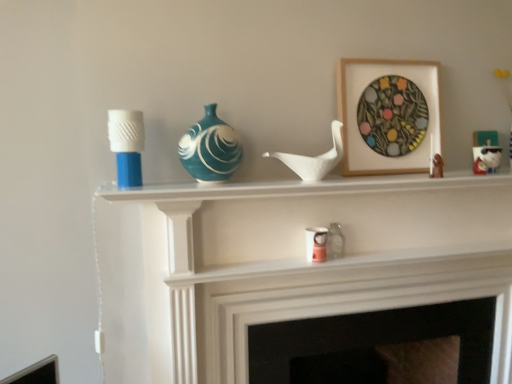
What do you see at coordinates (312, 263) in the screenshot? I see `white glossy fireplace at center` at bounding box center [312, 263].

Describe the element at coordinates (314, 158) in the screenshot. I see `white matte bird at center, the 3th toy when ordered from back to front` at that location.

The width and height of the screenshot is (512, 384). Identify the location of pink paper cup at center, placed as the 2th candle holder when sorted from top to bottom. (316, 244).

What do you see at coordinates (486, 152) in the screenshot? The image size is (512, 384). I see `white glossy figurine at upper right, which ranks as the first toy in right-to-left order` at bounding box center [486, 152].

The height and width of the screenshot is (384, 512). Identify the location of wooden picture frame at upper center. (356, 106).

Identify the location of white glossy fireplace at center. The image size is (512, 384). (312, 263).

Does teal glossy vase at center have a greater width compared to matte brown figurine at upper right, arranged as the second toy when viewed from the front?

Correct, the width of teal glossy vase at center exceeds that of matte brown figurine at upper right, arranged as the second toy when viewed from the front.

What's the angular difference between teal glossy vase at center and matte brown figurine at upper right, which is the 2th toy in left-to-right order,'s facing directions?

The angular difference between teal glossy vase at center and matte brown figurine at upper right, which is the 2th toy in left-to-right order, is 19 degrees.

Does teal glossy vase at center come behind matte brown figurine at upper right, placed as the second toy when sorted from right to left?

No, teal glossy vase at center is closer to the camera.

Is teal glossy vase at center located outside matte brown figurine at upper right, which is the 2th toy in left-to-right order?

Yes.

From the image's perspective, is matte brown figurine at upper right, arranged as the second toy when viewed from the front, over white glossy figurine at upper right, positioned as the third toy in left-to-right order?

No, from the image's perspective, matte brown figurine at upper right, arranged as the second toy when viewed from the front, is not on top of white glossy figurine at upper right, positioned as the third toy in left-to-right order.

Is matte brown figurine at upper right, placed as the second toy when sorted from right to left, completely or partially outside of white glossy figurine at upper right, which is the third toy from front to back?

Absolutely, matte brown figurine at upper right, placed as the second toy when sorted from right to left, is external to white glossy figurine at upper right, which is the third toy from front to back.

Does point (441, 158) lie in front of point (499, 159)?

Yes.

Are matte brown figurine at upper right, acting as the second toy starting from the back, and white glossy figurine at upper right, the 1th toy viewed from the back, located far from each other?

That's not correct — matte brown figurine at upper right, acting as the second toy starting from the back, is a little close to white glossy figurine at upper right, the 1th toy viewed from the back.

From the picture: Is white matte candle holder at left, arranged as the first candle holder when viewed from the left, far away from white glossy fireplace at center?

No, there isn't a large distance between white matte candle holder at left, arranged as the first candle holder when viewed from the left, and white glossy fireplace at center.

How much distance is there between white matte candle holder at left, which appears as the first candle holder when viewed from the top, and white glossy fireplace at center?

The distance of white matte candle holder at left, which appears as the first candle holder when viewed from the top, from white glossy fireplace at center is 23.85 inches.

Locate an element on the screen. The width and height of the screenshot is (512, 384). candle holder that appears in front of the white glossy fireplace at center is located at coordinates (127, 145).

Locate an element on the screen. The image size is (512, 384). the 3rd toy positioned above the white glossy fireplace at center (from a real-world perspective) is located at coordinates (314, 158).

Does white matte bird at center, the 3th toy when ordered from back to front, lie behind white glossy fireplace at center?

That is True.

Is white matte bird at center, the first toy from the front, outside of white glossy fireplace at center?

That's correct, white matte bird at center, the first toy from the front, is outside of white glossy fireplace at center.

Is white matte bird at center, the first toy from the front, to the left of white glossy fireplace at center from the viewer's perspective?

Yes.

Is matte white fireplace at center next to wooden picture frame at upper center?

matte white fireplace at center and wooden picture frame at upper center are not in contact.

In terms of width, does matte white fireplace at center look wider or thinner when compared to wooden picture frame at upper center?

Clearly, matte white fireplace at center has more width compared to wooden picture frame at upper center.

From the image's perspective, is matte white fireplace at center under wooden picture frame at upper center?

Yes, from the image's perspective, matte white fireplace at center is below wooden picture frame at upper center.

Locate an element on the screen. This screenshot has width=512, height=384. fireplace below the wooden picture frame at upper center (from the image's perspective) is located at coordinates (369, 343).

Can you confirm if teal glossy vase at center is shorter than white glossy fireplace at center?

Indeed, teal glossy vase at center has a lesser height compared to white glossy fireplace at center.

Are teal glossy vase at center and white glossy fireplace at center making contact?

There is a gap between teal glossy vase at center and white glossy fireplace at center.

Is white glossy fireplace at center completely or partially inside teal glossy vase at center?

Actually, white glossy fireplace at center is outside teal glossy vase at center.

Is matte white fireplace at center in contact with pink paper cup at center, which appears as the 1th candle holder when viewed from the back?

No, matte white fireplace at center is not in contact with pink paper cup at center, which appears as the 1th candle holder when viewed from the back.

How far apart are matte white fireplace at center and pink paper cup at center, arranged as the 1th candle holder when ordered from the bottom?

matte white fireplace at center and pink paper cup at center, arranged as the 1th candle holder when ordered from the bottom, are 17.98 inches apart from each other.

In the scene shown: Considering the relative sizes of matte white fireplace at center and pink paper cup at center, placed as the 2th candle holder when sorted from top to bottom, in the image provided, is matte white fireplace at center taller than pink paper cup at center, placed as the 2th candle holder when sorted from top to bottom,?

Indeed, matte white fireplace at center has a greater height compared to pink paper cup at center, placed as the 2th candle holder when sorted from top to bottom.

Is matte white fireplace at center looking in the opposite direction of pink paper cup at center, which is counted as the second candle holder, starting from the left?

No, matte white fireplace at center is not facing the opposite direction of pink paper cup at center, which is counted as the second candle holder, starting from the left.

Identify the location of vase that appears above the matte brown figurine at upper right, placed as the second toy when sorted from right to left (from a real-world perspective). (210, 148).

At what (x,y) coordinates should I click in order to perform the action: click on the 2nd toy positioned above the matte brown figurine at upper right, placed as the second toy when sorted from right to left (from the image's perspective). Please return your answer as a coordinate pair (x, y). Looking at the image, I should click on (486, 152).

When comparing their distances from white glossy fireplace at center, does white glossy shelf at upper center or white matte candle holder at left, placed as the second candle holder when sorted from right to left, seem further?

white matte candle holder at left, placed as the second candle holder when sorted from right to left, is positioned further to the anchor white glossy fireplace at center.

Estimate the real-world distances between objects in this image. Which object is closer to wooden picture frame at upper center, matte brown figurine at upper right, which is the 2th toy in left-to-right order, or teal glossy vase at center?

The object closer to wooden picture frame at upper center is matte brown figurine at upper right, which is the 2th toy in left-to-right order.

From the image, which object appears to be farther from white glossy figurine at upper right, the 1th toy viewed from the back, pink paper cup at center, arranged as the 1th candle holder when ordered from the bottom, or matte white fireplace at center?

pink paper cup at center, arranged as the 1th candle holder when ordered from the bottom, is further to white glossy figurine at upper right, the 1th toy viewed from the back.

Based on their spatial positions, is wooden picture frame at upper center or white matte bird at center, arranged as the third toy when viewed from the right, further from pink paper cup at center, arranged as the 1th candle holder when ordered from the bottom?

Based on the image, wooden picture frame at upper center appears to be further to pink paper cup at center, arranged as the 1th candle holder when ordered from the bottom.

Looking at the image, which one is located closer to white matte bird at center, the first toy from the front, white glossy shelf at upper center or pink paper cup at center, placed as the 2th candle holder when sorted from front to back?

white glossy shelf at upper center is positioned closer to the anchor white matte bird at center, the first toy from the front.

Looking at the image, which one is located further to pink paper cup at center, placed as the 2th candle holder when sorted from top to bottom, matte brown figurine at upper right, acting as the second toy starting from the back, or white glossy shelf at upper center?

matte brown figurine at upper right, acting as the second toy starting from the back, is positioned further to the anchor pink paper cup at center, placed as the 2th candle holder when sorted from top to bottom.

Looking at the image, which one is located closer to white glossy figurine at upper right, which is the third toy from front to back, teal glossy vase at center or white matte bird at center, the first toy positioned from the left?

white matte bird at center, the first toy positioned from the left, is positioned closer to the anchor white glossy figurine at upper right, which is the third toy from front to back.

Estimate the real-world distances between objects in this image. Which object is further from matte brown figurine at upper right, arranged as the second toy when viewed from the front, wooden picture frame at upper center or white matte candle holder at left, which appears as the first candle holder when viewed from the top?

white matte candle holder at left, which appears as the first candle holder when viewed from the top, is positioned further to the anchor matte brown figurine at upper right, arranged as the second toy when viewed from the front.

This screenshot has height=384, width=512. What are the coordinates of `toy between pink paper cup at center, the 1th candle holder in the right-to-left sequence, and white glossy figurine at upper right, which ranks as the first toy in right-to-left order` in the screenshot? It's located at (437, 166).

The height and width of the screenshot is (384, 512). Identify the location of candle holder between teal glossy vase at center and wooden picture frame at upper center. (316, 244).

I want to click on picture frame between white matte bird at center, arranged as the third toy when viewed from the right, and white glossy figurine at upper right, positioned as the third toy in left-to-right order, from left to right, so click(x=356, y=106).

Image resolution: width=512 pixels, height=384 pixels. Identify the location of mantle situated between white matte bird at center, the first toy from the front, and white glossy figurine at upper right, which is the third toy from front to back, from left to right. (305, 187).